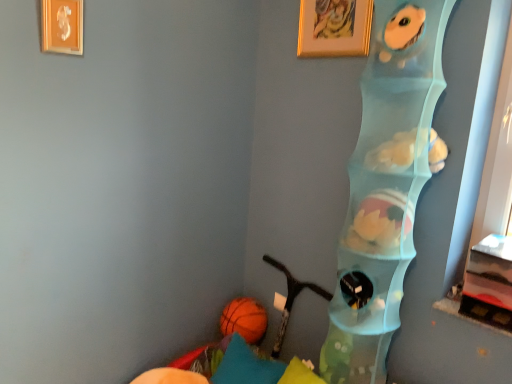
The height and width of the screenshot is (384, 512). What do you see at coordinates (390, 158) in the screenshot? I see `translucent plastic shelf at right` at bounding box center [390, 158].

What do you see at coordinates (401, 35) in the screenshot?
I see `fluffy blue plush toy at upper right, arranged as the first animal when viewed from the top` at bounding box center [401, 35].

The height and width of the screenshot is (384, 512). What do you see at coordinates (246, 366) in the screenshot?
I see `teal fabric pillow at lower left` at bounding box center [246, 366].

You are a GUI agent. You are given a task and a screenshot of the screen. Output one action in this format:
    pyautogui.click(x=<x>, y=<y>)
    Task: Click on the translucent plastic shelf at right
    
    Given the screenshot: What is the action you would take?
    pyautogui.click(x=390, y=158)

Is orange rubber ball at lower left oriented towards teal fabric pillow at lower left?

No, orange rubber ball at lower left is not oriented towards teal fabric pillow at lower left.

Can you confirm if orange rubber ball at lower left is shorter than teal fabric pillow at lower left?

Correct, orange rubber ball at lower left is not as tall as teal fabric pillow at lower left.

Is orange rubber ball at lower left beside teal fabric pillow at lower left?

No, orange rubber ball at lower left is not in contact with teal fabric pillow at lower left.

Where is `ball that appears below the white plush toy at center, the 2th animal positioned from the top (from a real-world perspective)`? The image size is (512, 384). ball that appears below the white plush toy at center, the 2th animal positioned from the top (from a real-world perspective) is located at coordinates (244, 319).

From the image's perspective, is orange rubber ball at lower left on white plush toy at center, the 1th animal positioned from the bottom?

No.

Considering the sizes of objects orange rubber ball at lower left and white plush toy at center, the 2th animal positioned from the top, in the image provided, who is shorter, orange rubber ball at lower left or white plush toy at center, the 2th animal positioned from the top,?

white plush toy at center, the 2th animal positioned from the top.

From their relative heights in the image, would you say fluffy blue plush toy at upper right, arranged as the first animal when viewed from the top, is taller or shorter than gold metallic picture frame at upper left, the second picture frame positioned from the back?

Clearly, fluffy blue plush toy at upper right, arranged as the first animal when viewed from the top, is shorter compared to gold metallic picture frame at upper left, the second picture frame positioned from the back.

Is fluffy blue plush toy at upper right, arranged as the first animal when viewed from the top, next to gold metallic picture frame at upper left, the 2th picture frame from the right, and touching it?

fluffy blue plush toy at upper right, arranged as the first animal when viewed from the top, and gold metallic picture frame at upper left, the 2th picture frame from the right, are clearly separated.

Starting from the gold metallic picture frame at upper left, positioned as the 1th picture frame in front-to-back order, which animal is the 1st one to the right? Please provide its 2D coordinates.

[(401, 35)]

What's the angular difference between white plush toy at center, the 1th animal positioned from the bottom, and gold metallic picture frame at upper left, the 1th picture frame in the left-to-right sequence,'s facing directions?

There is a 91.4-degree angle between the facing directions of white plush toy at center, the 1th animal positioned from the bottom, and gold metallic picture frame at upper left, the 1th picture frame in the left-to-right sequence.

Is white plush toy at center, the 2th animal positioned from the top, oriented away from gold metallic picture frame at upper left, the second picture frame positioned from the back?

No.

Between white plush toy at center, the 1th animal positioned from the bottom, and gold metallic picture frame at upper left, the 1th picture frame in the left-to-right sequence, which one has larger size?

Bigger between the two is white plush toy at center, the 1th animal positioned from the bottom.

Is white plush toy at center, the 1th animal positioned from the bottom, next to gold metallic picture frame at upper left, the 1th picture frame in the left-to-right sequence?

No, white plush toy at center, the 1th animal positioned from the bottom, is not in contact with gold metallic picture frame at upper left, the 1th picture frame in the left-to-right sequence.

Consider the image. From the image's perspective, is translucent plastic shelf at right below teal fabric pillow at lower left?

No.

In the scene shown: Does translucent plastic shelf at right turn towards teal fabric pillow at lower left?

No, translucent plastic shelf at right is not facing towards teal fabric pillow at lower left.

Based on the photo, would you say translucent plastic shelf at right contains teal fabric pillow at lower left?

No, teal fabric pillow at lower left is not inside translucent plastic shelf at right.

From a real-world perspective, is translucent plastic shelf at right positioned over teal fabric pillow at lower left based on gravity?

Yes.

Consider the image. Is gold metallic picture frame at upper left, positioned as the 1th picture frame in front-to-back order, taller than orange rubber ball at lower left?

Incorrect, the height of gold metallic picture frame at upper left, positioned as the 1th picture frame in front-to-back order, is not larger of that of orange rubber ball at lower left.

Considering their positions, is gold metallic picture frame at upper left, the second picture frame positioned from the back, located in front of or behind orange rubber ball at lower left?

gold metallic picture frame at upper left, the second picture frame positioned from the back, is positioned closer to the viewer than orange rubber ball at lower left.

At what (x,y) coordinates should I click in order to perform the action: click on ball lying behind the gold metallic picture frame at upper left, positioned as the 1th picture frame in front-to-back order. Please return your answer as a coordinate pair (x, y). The height and width of the screenshot is (384, 512). Looking at the image, I should click on tap(244, 319).

Is fluffy blue plush toy at upper right, the second animal positioned from the bottom, turned away from translucent plastic shelf at right?

That's right, fluffy blue plush toy at upper right, the second animal positioned from the bottom, is facing away from translucent plastic shelf at right.

Which object is wider, fluffy blue plush toy at upper right, arranged as the first animal when viewed from the top, or translucent plastic shelf at right?

Wider between the two is translucent plastic shelf at right.

From a real-world perspective, relative to translucent plastic shelf at right, is fluffy blue plush toy at upper right, the second animal positioned from the bottom, vertically above or below?

fluffy blue plush toy at upper right, the second animal positioned from the bottom, is situated higher than translucent plastic shelf at right in the real world.

Considering the relative sizes of fluffy blue plush toy at upper right, the second animal positioned from the bottom, and translucent plastic shelf at right in the image provided, is fluffy blue plush toy at upper right, the second animal positioned from the bottom, shorter than translucent plastic shelf at right?

Yes, fluffy blue plush toy at upper right, the second animal positioned from the bottom, is shorter than translucent plastic shelf at right.

Find the location of a particular element. ball located above the teal fabric pillow at lower left (from a real-world perspective) is located at coordinates (244, 319).

What are the coordinates of `ball on the left of white plush toy at center, the 1th animal positioned from the bottom` in the screenshot? It's located at (244, 319).

When comparing their distances from white plush toy at center, the 1th animal positioned from the bottom, does gold metallic picture frame at upper left, positioned as the 1th picture frame in front-to-back order, or teal fabric pillow at lower left seem further?

gold metallic picture frame at upper left, positioned as the 1th picture frame in front-to-back order.

Estimate the real-world distances between objects in this image. Which object is further from gold metallic picture frame at upper left, the 1th picture frame in the left-to-right sequence, orange rubber ball at lower left or gold-framed picture at upper center, which is the first picture frame in back-to-front order?

Based on the image, orange rubber ball at lower left appears to be further to gold metallic picture frame at upper left, the 1th picture frame in the left-to-right sequence.

Which object lies nearer to the anchor point gold metallic picture frame at upper left, the second picture frame positioned from the back, fluffy blue plush toy at upper right, the second animal positioned from the bottom, or orange rubber ball at lower left?

fluffy blue plush toy at upper right, the second animal positioned from the bottom, is positioned closer to the anchor gold metallic picture frame at upper left, the second picture frame positioned from the back.

When comparing their distances from white plush toy at center, the 2th animal positioned from the top, does gold-framed picture at upper center, which is the first picture frame in right-to-left order, or teal fabric pillow at lower left seem closer?

gold-framed picture at upper center, which is the first picture frame in right-to-left order, lies closer to white plush toy at center, the 2th animal positioned from the top, than the other object.

Looking at the image, which one is located closer to gold-framed picture at upper center, which is the first picture frame in right-to-left order, orange rubber ball at lower left or white plush toy at center, the 2th animal positioned from the top?

Among the two, white plush toy at center, the 2th animal positioned from the top, is located nearer to gold-framed picture at upper center, which is the first picture frame in right-to-left order.

From the image, which object appears to be farther from translucent plastic shelf at right, white plush toy at center, the 1th animal positioned from the bottom, or fluffy blue plush toy at upper right, arranged as the first animal when viewed from the top?

fluffy blue plush toy at upper right, arranged as the first animal when viewed from the top, is positioned further to the anchor translucent plastic shelf at right.

Which object lies nearer to the anchor point fluffy blue plush toy at upper right, the second animal positioned from the bottom, white plush toy at center, the 2th animal positioned from the top, or orange rubber ball at lower left?

The object closer to fluffy blue plush toy at upper right, the second animal positioned from the bottom, is white plush toy at center, the 2th animal positioned from the top.

Estimate the real-world distances between objects in this image. Which object is further from orange rubber ball at lower left, fluffy blue plush toy at upper right, arranged as the first animal when viewed from the top, or white plush toy at center, the 2th animal positioned from the top?

fluffy blue plush toy at upper right, arranged as the first animal when viewed from the top, is positioned further to the anchor orange rubber ball at lower left.

I want to click on picture frame between gold metallic picture frame at upper left, positioned as the 1th picture frame in front-to-back order, and white plush toy at center, the 1th animal positioned from the bottom, so click(x=334, y=28).

What are the coordinates of `shelf between gold metallic picture frame at upper left, positioned as the 1th picture frame in front-to-back order, and white plush toy at center, the 2th animal positioned from the top` in the screenshot? It's located at (390, 158).

Where is `animal between fluffy blue plush toy at upper right, arranged as the first animal when viewed from the top, and translucent plastic shelf at right, in the vertical direction`? Image resolution: width=512 pixels, height=384 pixels. animal between fluffy blue plush toy at upper right, arranged as the first animal when viewed from the top, and translucent plastic shelf at right, in the vertical direction is located at coordinates (393, 153).

You are a GUI agent. You are given a task and a screenshot of the screen. Output one action in this format:
    pyautogui.click(x=<x>, y=<y>)
    Task: Click on the picture frame between gold metallic picture frame at upper left, the 2th picture frame from the right, and fluffy blue plush toy at upper right, the second animal positioned from the bottom, from left to right
    The height and width of the screenshot is (384, 512).
    Given the screenshot: What is the action you would take?
    pyautogui.click(x=334, y=28)